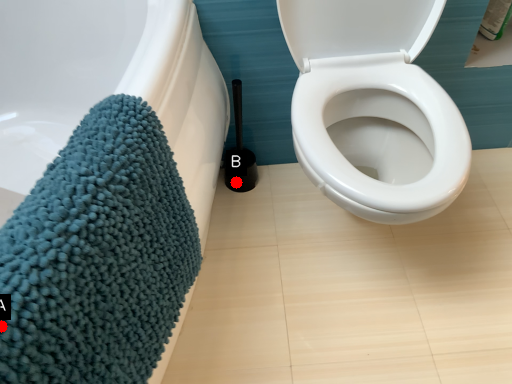
Question: Two points are circled on the image, labeled by A and B beside each circle. Which point is closer to the camera?

Choices:
 (A) A is closer
 (B) B is closer

Answer: (A)